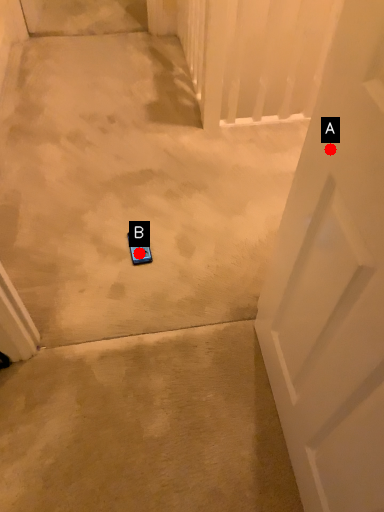
Question: Two points are circled on the image, labeled by A and B beside each circle. Which point appears closest to the camera in this image?

Choices:
 (A) A is closer
 (B) B is closer

Answer: (A)